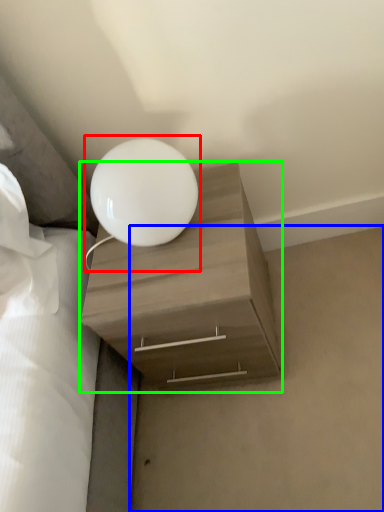
Question: Which object is the farthest from lamp (highlighted by a red box)? Choose among these: concrete (highlighted by a blue box) or nightstand (highlighted by a green box).

Choices:
 (A) concrete
 (B) nightstand

Answer: (A)